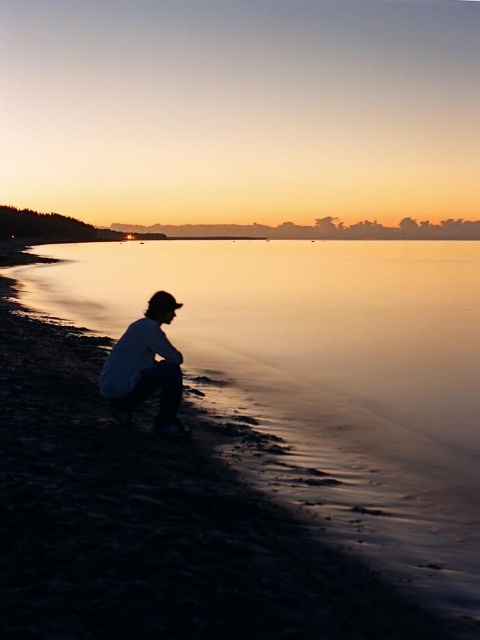
Between silky smooth water at center and matte white shirt at lower center, which one has more height?

silky smooth water at center

Is silky smooth water at center to the right of matte white shirt at lower center from the viewer's perspective?

Yes, silky smooth water at center is to the right of matte white shirt at lower center.

Is point (23, 275) positioned after point (135, 326)?

Yes, it is behind point (135, 326).

This screenshot has width=480, height=640. Identify the location of silky smooth water at center. (299, 321).